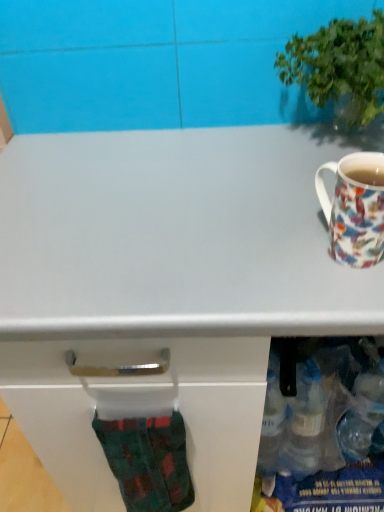
Question: Based on their sizes in the image, would you say green plaid sock at lower left is bigger or smaller than porcelain floral mug at right?

Choices:
 (A) big
 (B) small

Answer: (A)

Question: From the image's perspective, is green plaid sock at lower left above or below porcelain floral mug at right?

Choices:
 (A) below
 (B) above

Answer: (A)

Question: Which object is positioned farthest from the green leafy plant at upper right?

Choices:
 (A) green plaid sock at lower left
 (B) porcelain floral mug at right

Answer: (A)

Question: Which object is positioned closest to the porcelain floral mug at right?

Choices:
 (A) green leafy plant at upper right
 (B) green plaid sock at lower left

Answer: (A)